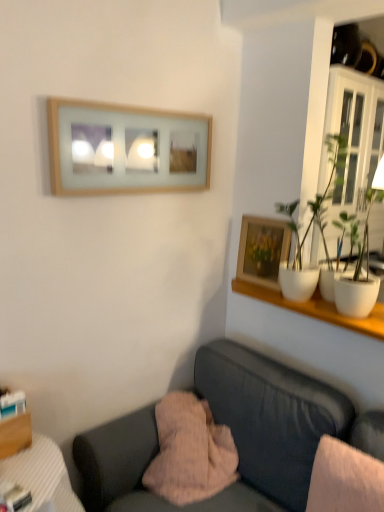
Question: Is velvet dark gray couch at lower center looking in the opposite direction of white glossy pot at upper right?

Choices:
 (A) yes
 (B) no

Answer: (B)

Question: From a real-world perspective, is velvet dark gray couch at lower center located beneath white glossy pot at upper right?

Choices:
 (A) no
 (B) yes

Answer: (B)

Question: From the image's perspective, does velvet dark gray couch at lower center appear higher than white glossy pot at upper right?

Choices:
 (A) no
 (B) yes

Answer: (A)

Question: Are velvet dark gray couch at lower center and white glossy pot at upper right far apart?

Choices:
 (A) yes
 (B) no

Answer: (B)

Question: Considering the relative sizes of velvet dark gray couch at lower center and white glossy pot at upper right in the image provided, is velvet dark gray couch at lower center wider than white glossy pot at upper right?

Choices:
 (A) no
 (B) yes

Answer: (B)

Question: From a real-world perspective, relative to white glossy shelf at upper right, is wooden frame at upper center, positioned as the 1th picture frame in left-to-right order, vertically above or below?

Choices:
 (A) below
 (B) above

Answer: (B)

Question: In terms of width, does wooden frame at upper center, positioned as the 1th picture frame in left-to-right order, look wider or thinner when compared to white glossy shelf at upper right?

Choices:
 (A) wide
 (B) thin

Answer: (B)

Question: Considering the positions of wooden frame at upper center, which ranks as the first picture frame in top-to-bottom order, and white glossy shelf at upper right in the image, is wooden frame at upper center, which ranks as the first picture frame in top-to-bottom order, bigger or smaller than white glossy shelf at upper right?

Choices:
 (A) small
 (B) big

Answer: (B)

Question: Is point (109, 190) positioned closer to the camera than point (345, 323)?

Choices:
 (A) closer
 (B) farther

Answer: (B)

Question: Does point (124, 459) appear closer or farther from the camera than point (178, 411)?

Choices:
 (A) farther
 (B) closer

Answer: (B)

Question: In terms of size, does velvet dark gray couch at lower center appear bigger or smaller than pink fuzzy pillow at lower center?

Choices:
 (A) small
 (B) big

Answer: (B)

Question: From a real-world perspective, relative to pink fuzzy pillow at lower center, is velvet dark gray couch at lower center vertically above or below?

Choices:
 (A) above
 (B) below

Answer: (B)

Question: In terms of height, does velvet dark gray couch at lower center look taller or shorter compared to pink fuzzy pillow at lower center?

Choices:
 (A) short
 (B) tall

Answer: (B)

Question: Do you think white glossy shelf at upper right is within velvet dark gray couch at lower center, or outside of it?

Choices:
 (A) outside
 (B) inside

Answer: (A)

Question: From the image's perspective, is white glossy shelf at upper right positioned above or below velvet dark gray couch at lower center?

Choices:
 (A) above
 (B) below

Answer: (A)